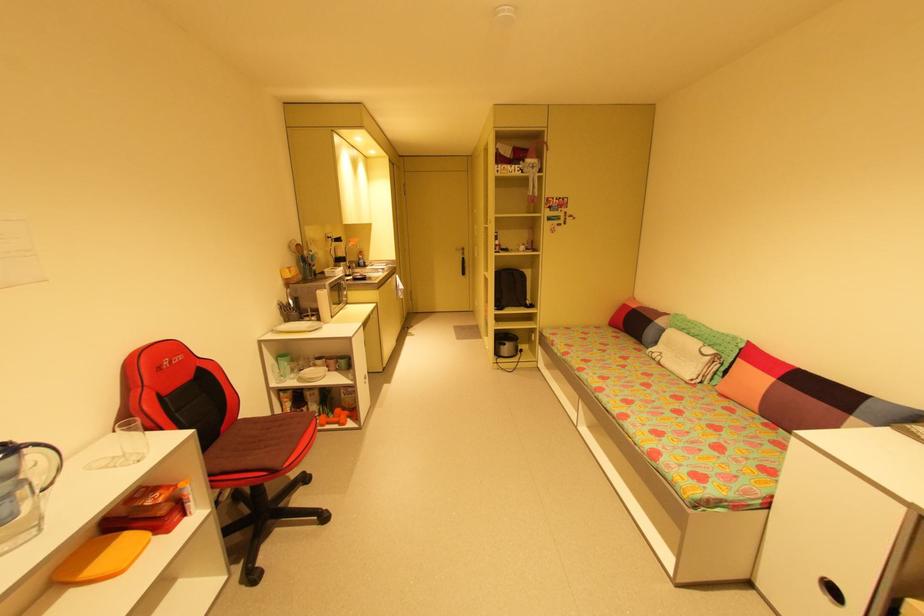
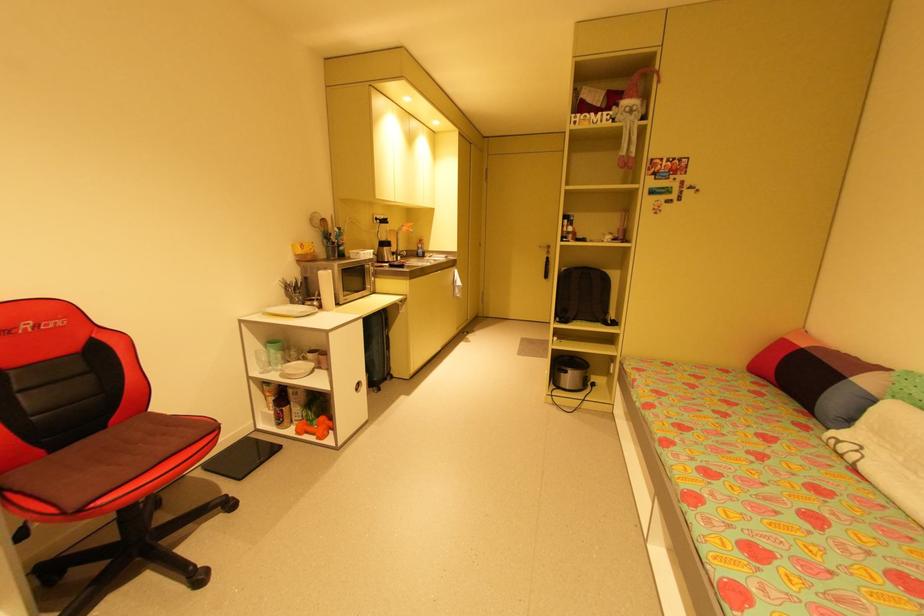
Question: The images are taken continuously from a first-person perspective. In which direction is your viewpoint rotating?

Choices:
 (A) Left
 (B) Right
 (C) Up
 (D) Down

Answer: (A)